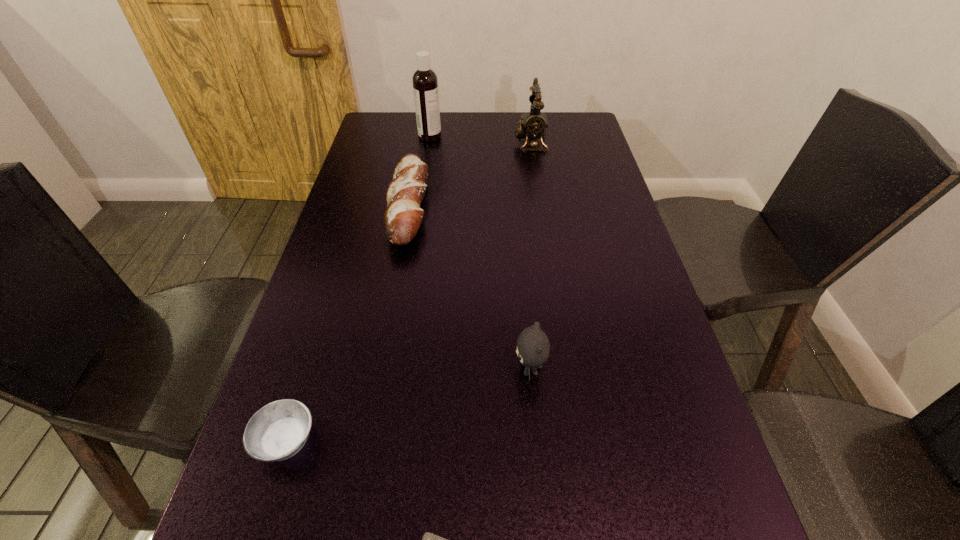
Locate an element on the screen. The width and height of the screenshot is (960, 540). free space located on the rotary dial of the fifth shortest object is located at coordinates (403, 143).

Locate an element on the screen. blank space located 0.320m on the rotary dial of the fifth shortest object is located at coordinates (419, 143).

The image size is (960, 540). I want to click on vacant area situated 0.130m on the front-facing side of the fourth shortest object, so pos(448,369).

Find the location of a particular element. This screenshot has height=540, width=960. free space located 0.350m on the front-facing side of the fourth shortest object is located at coordinates (336, 369).

Where is `free space located 0.170m on the front-facing side of the fourth shortest object`? Image resolution: width=960 pixels, height=540 pixels. free space located 0.170m on the front-facing side of the fourth shortest object is located at coordinates 428,369.

This screenshot has width=960, height=540. Find the location of `free region located 0.250m on the right of the fourth nearest object`. free region located 0.250m on the right of the fourth nearest object is located at coordinates (517, 207).

This screenshot has width=960, height=540. In order to click on blank area located on the back of the second shortest object in this screenshot , I will do (x=334, y=287).

Locate an element on the screen. The image size is (960, 540). dishwasher detergent located in the far edge section of the desktop is located at coordinates (425, 83).

In order to click on telephone that is at the far edge in this screenshot , I will do pyautogui.click(x=533, y=125).

I want to click on baguet situated at the left edge, so click(x=403, y=216).